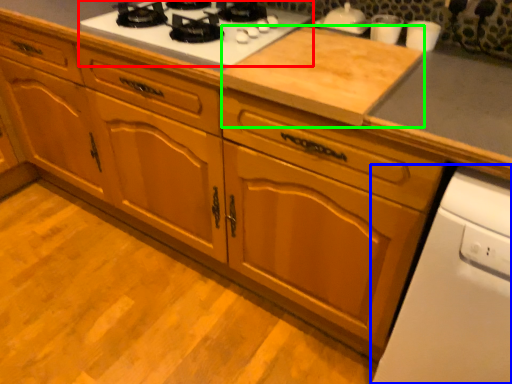
Question: Based on their relative distances, which object is farther from gas stove (highlighted by a red box)? Choose from home appliance (highlighted by a blue box) and plywood (highlighted by a green box).

Choices:
 (A) home appliance
 (B) plywood

Answer: (A)